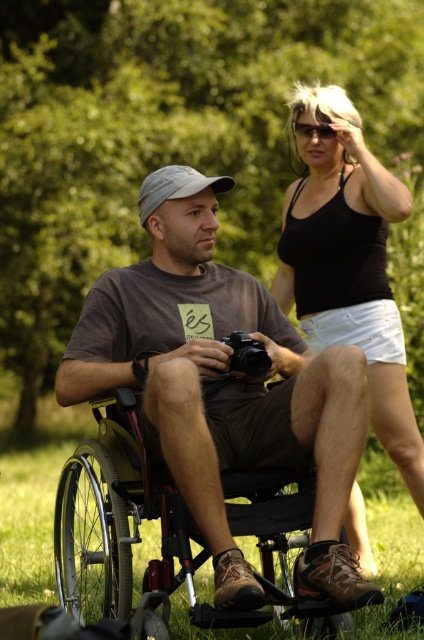
Is point (368, 588) behind point (384, 244)?

That is False.

Is point (340, 515) behind point (326, 260)?

That is False.

Where is `matte brown wheelchair at center`? This screenshot has height=640, width=424. matte brown wheelchair at center is located at coordinates (225, 394).

Does matte gray baseball cap at center appear on the right side of black plastic camera at center?

No, matte gray baseball cap at center is not to the right of black plastic camera at center.

Which is more to the right, matte gray baseball cap at center or black plastic camera at center?

black plastic camera at center

Where is `matte gray baseball cap at center`? Image resolution: width=424 pixels, height=640 pixels. matte gray baseball cap at center is located at coordinates (175, 186).

The image size is (424, 640). Identify the location of matte gray baseball cap at center. (175, 186).

Between black tank top at upper right and metallic silver wheelchair at lower left, which one has less height?

metallic silver wheelchair at lower left

Does point (371, 216) come closer to viewer compared to point (217, 612)?

No, (371, 216) is behind (217, 612).

I want to click on black tank top at upper right, so click(x=348, y=264).